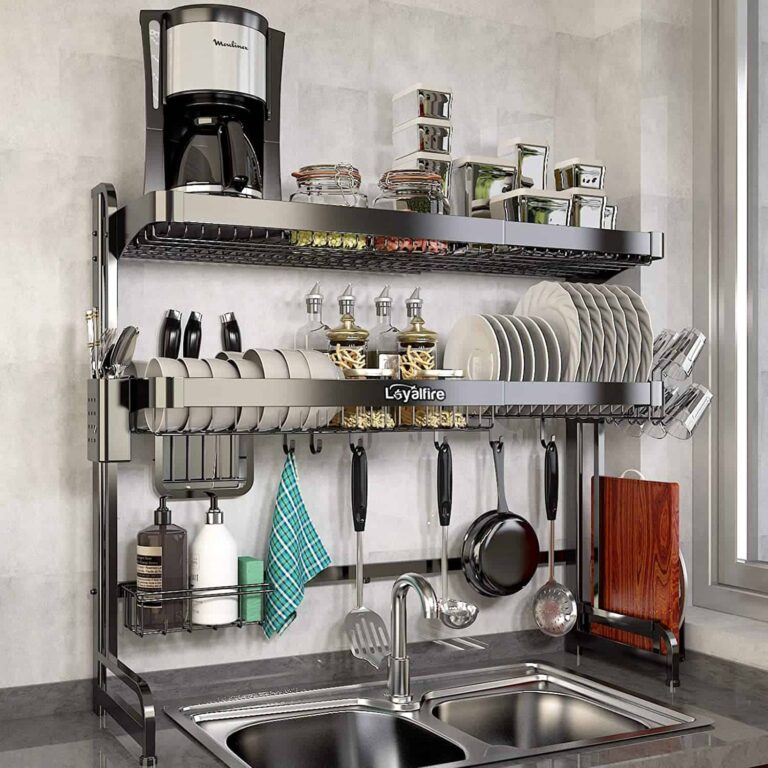
Find the location of `basin`. basin is located at coordinates (518, 726), (363, 756).